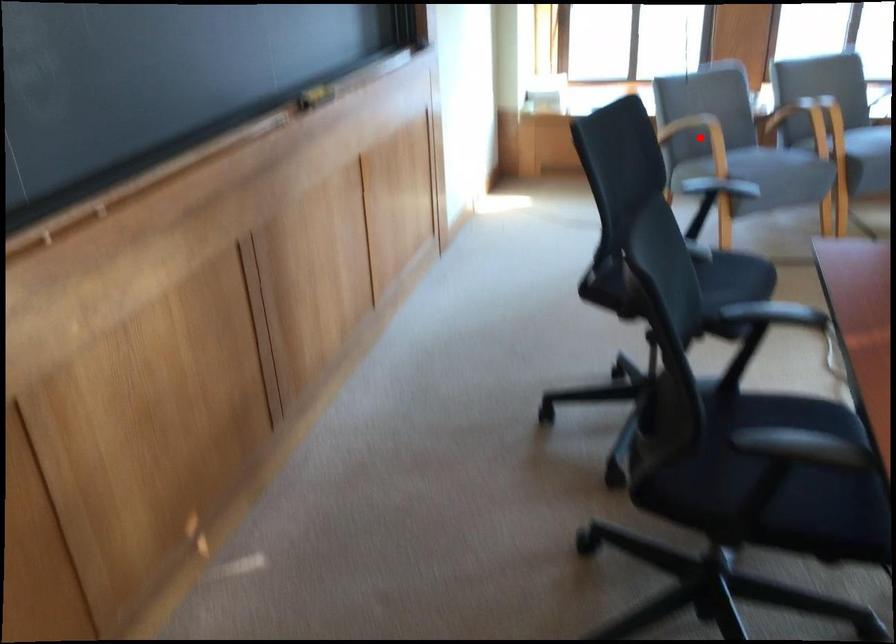
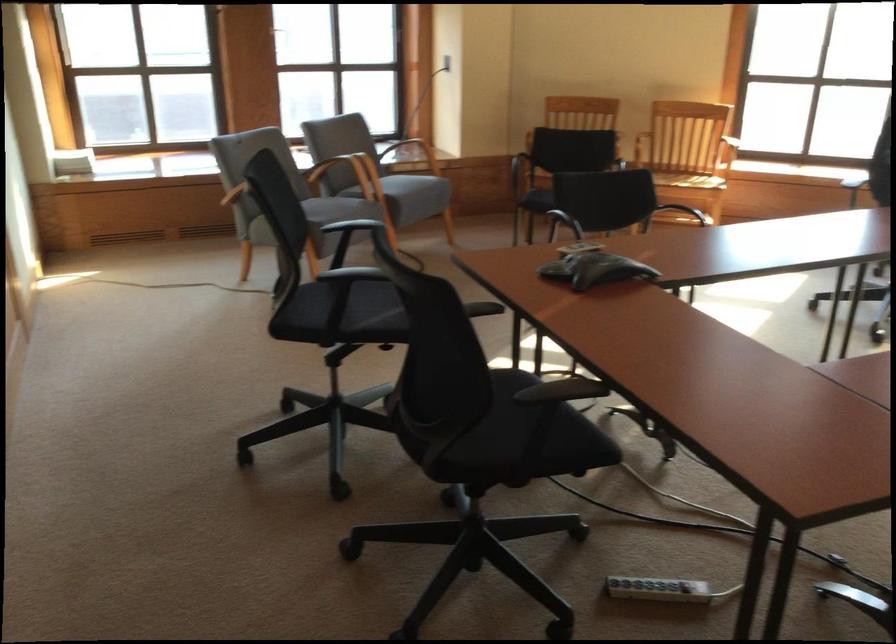
Question: I am providing you with two images of the same scene from different viewpoints. A red point is marked on the first image. Is the red point's position out of view in image 2?

Choices:
 (A) Yes
 (B) No

Answer: (A)